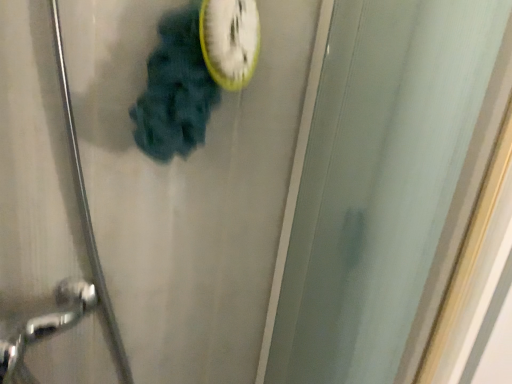
Question: Is transparent glass screen door at center a part of white plastic clock at upper center?

Choices:
 (A) no
 (B) yes

Answer: (A)

Question: Would you say white plastic clock at upper center is outside transparent glass screen door at center?

Choices:
 (A) yes
 (B) no

Answer: (A)

Question: Does white plastic clock at upper center have a lesser width compared to transparent glass screen door at center?

Choices:
 (A) yes
 (B) no

Answer: (A)

Question: Is white plastic clock at upper center looking in the opposite direction of transparent glass screen door at center?

Choices:
 (A) yes
 (B) no

Answer: (B)

Question: From a real-world perspective, is white plastic clock at upper center over transparent glass screen door at center?

Choices:
 (A) no
 (B) yes

Answer: (B)

Question: Can you confirm if white plastic clock at upper center is shorter than transparent glass screen door at center?

Choices:
 (A) no
 (B) yes

Answer: (B)

Question: Considering the relative sizes of transparent glass screen door at center and white plastic clock at upper center in the image provided, is transparent glass screen door at center taller than white plastic clock at upper center?

Choices:
 (A) no
 (B) yes

Answer: (B)

Question: Is transparent glass screen door at center bigger than white plastic clock at upper center?

Choices:
 (A) yes
 (B) no

Answer: (A)

Question: Is transparent glass screen door at center oriented towards white plastic clock at upper center?

Choices:
 (A) no
 (B) yes

Answer: (A)

Question: Is transparent glass screen door at center thinner than white plastic clock at upper center?

Choices:
 (A) yes
 (B) no

Answer: (B)

Question: Is transparent glass screen door at center to the right of white plastic clock at upper center from the viewer's perspective?

Choices:
 (A) yes
 (B) no

Answer: (A)

Question: Is transparent glass screen door at center at the left side of white plastic clock at upper center?

Choices:
 (A) no
 (B) yes

Answer: (A)

Question: Considering the positions of transparent glass screen door at center and white plastic clock at upper center in the image, is transparent glass screen door at center wider or thinner than white plastic clock at upper center?

Choices:
 (A) wide
 (B) thin

Answer: (A)